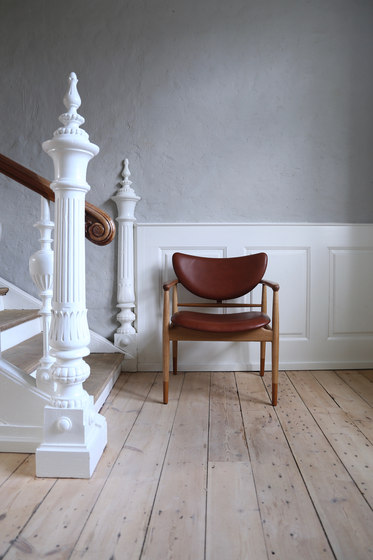
Generate point markers for all what you place your hand on while climbing stairs in the image. Your answer should be formatted as a list of tuples, i.e. [(x1, y1), (x2, y2), ...], where each tuple contains the x and y coordinates of a point satisfying the conditions above.

[(33, 182)]